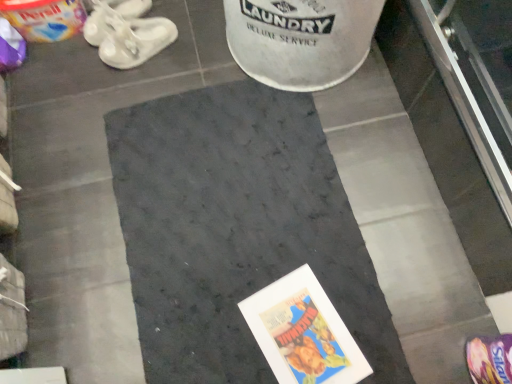
Question: Considering the positions of purple fabric footwear at lower right, which ranks as the third footwear in back-to-front order, and white rubber sandals at upper left, which is the second footwear from right to left, in the image, is purple fabric footwear at lower right, which ranks as the third footwear in back-to-front order, bigger or smaller than white rubber sandals at upper left, which is the second footwear from right to left,?

Choices:
 (A) small
 (B) big

Answer: (A)

Question: From the image's perspective, is purple fabric footwear at lower right, acting as the first footwear starting from the bottom, above or below white rubber sandals at upper left, which is the second footwear from right to left?

Choices:
 (A) above
 (B) below

Answer: (B)

Question: Which of these objects is positioned farthest from the white rubber sandals at upper left, the second footwear in the back-to-front sequence?

Choices:
 (A) white rubber shoes at upper left, the 3th footwear when ordered from front to back
 (B) purple fabric footwear at lower right, the 3th footwear from the left
 (C) dark gray carpet at center

Answer: (B)

Question: Which object is the farthest from the dark gray carpet at center?

Choices:
 (A) white rubber shoes at upper left, which is the 3th footwear from right to left
 (B) white rubber sandals at upper left, the 2th footwear positioned from the top
 (C) purple fabric footwear at lower right, arranged as the 3th footwear when viewed from the top

Answer: (A)